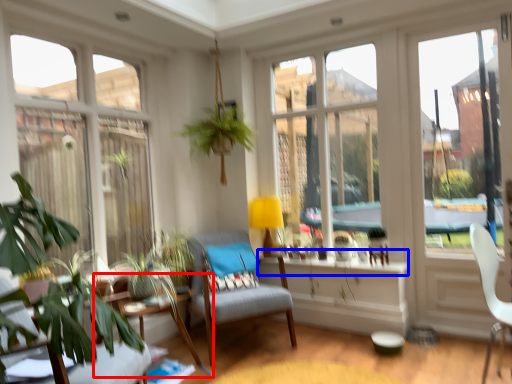
Question: Among these objects, which one is nearest to the camera, table (highlighted by a red box) or window sill (highlighted by a blue box)?

Choices:
 (A) table
 (B) window sill

Answer: (A)